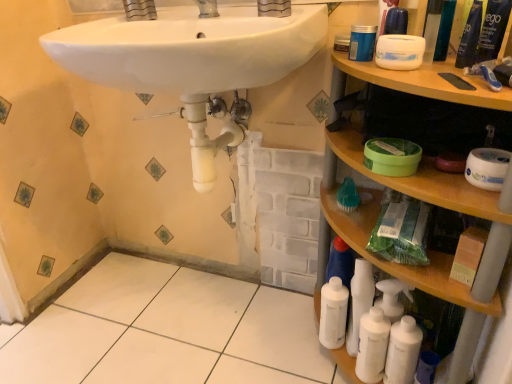
The width and height of the screenshot is (512, 384). Identify the location of free space between white matte toothpaste at upper right and blue plastic mouthwash at upper right, which is the 2th mouthwash in top-to-bottom order. (458, 72).